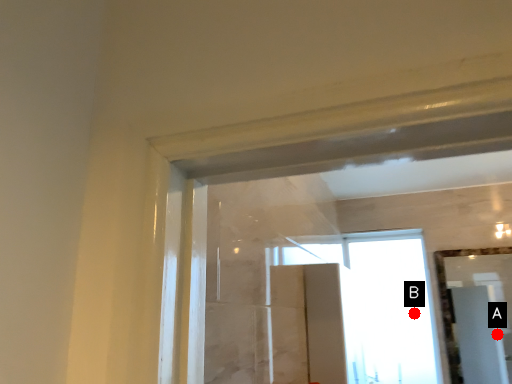
Question: Two points are circled on the image, labeled by A and B beside each circle. Among these points, which one is nearest to the camera?

Choices:
 (A) A is closer
 (B) B is closer

Answer: (B)